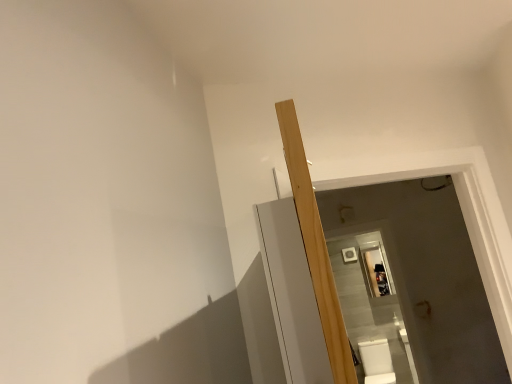
Question: From the image's perspective, would you say light wood beam at center is shown under white glossy toilet bowl at lower right?

Choices:
 (A) no
 (B) yes

Answer: (A)

Question: From a real-world perspective, does light wood beam at center sit lower than white glossy toilet bowl at lower right?

Choices:
 (A) no
 (B) yes

Answer: (A)

Question: Is light wood beam at center in front of white glossy toilet bowl at lower right?

Choices:
 (A) no
 (B) yes

Answer: (B)

Question: Does light wood beam at center have a lesser height compared to white glossy toilet bowl at lower right?

Choices:
 (A) yes
 (B) no

Answer: (B)

Question: From a real-world perspective, is light wood beam at center on white glossy toilet bowl at lower right?

Choices:
 (A) no
 (B) yes

Answer: (B)

Question: Does light wood beam at center contain white glossy toilet bowl at lower right?

Choices:
 (A) no
 (B) yes

Answer: (A)

Question: Does white glossy toilet bowl at lower right have a lesser width compared to light wood beam at center?

Choices:
 (A) no
 (B) yes

Answer: (A)

Question: From a real-world perspective, is white glossy toilet bowl at lower right physically below light wood beam at center?

Choices:
 (A) no
 (B) yes

Answer: (B)

Question: Is white glossy toilet bowl at lower right shorter than light wood beam at center?

Choices:
 (A) yes
 (B) no

Answer: (A)

Question: Is white glossy toilet bowl at lower right completely or partially outside of light wood beam at center?

Choices:
 (A) no
 (B) yes

Answer: (B)

Question: From the image's perspective, is white glossy toilet bowl at lower right on top of light wood beam at center?

Choices:
 (A) yes
 (B) no

Answer: (B)

Question: Does white glossy toilet bowl at lower right have a larger size compared to light wood beam at center?

Choices:
 (A) no
 (B) yes

Answer: (B)

Question: From a real-world perspective, is light wood beam at center positioned above or below white glossy toilet bowl at lower right?

Choices:
 (A) above
 (B) below

Answer: (A)